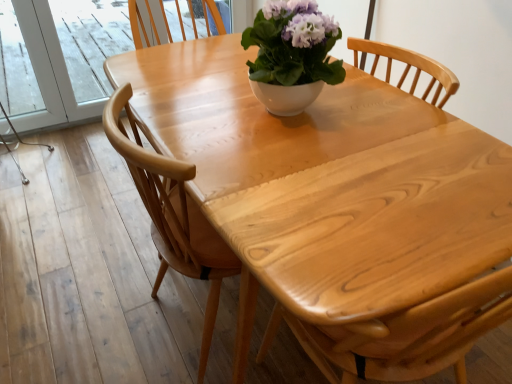
You are a GUI agent. You are given a task and a screenshot of the screen. Output one action in this format:
    pyautogui.click(x=<x>, y=<y>)
    Task: Click on the vacant region to the left of light wood chair at center
    
    Given the screenshot: What is the action you would take?
    coord(106,311)